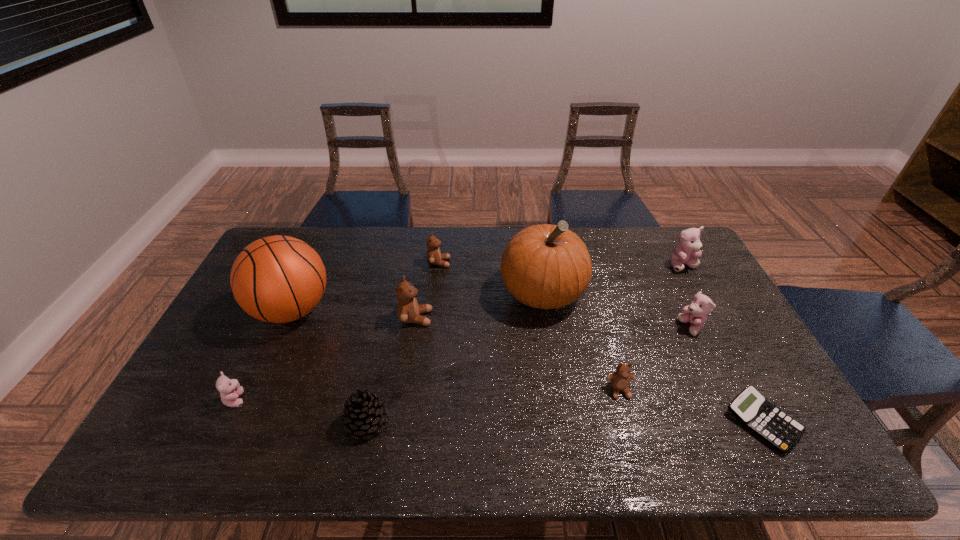
You are a GUI agent. You are given a task and a screenshot of the screen. Output one action in this format:
    pyautogui.click(x=<x>, y=<y>)
    Task: Click on the brown teddy bear that stands as the closest to the farthest pink teddy bear
    
    Given the screenshot: What is the action you would take?
    pyautogui.click(x=620, y=380)

This screenshot has width=960, height=540. I want to click on brown teddy bear object that ranks as the third closest to the pinecone, so click(x=620, y=380).

The width and height of the screenshot is (960, 540). What are the coordinates of `vacant position in the image that satisfies the following two spatial constraints: 1. at the face of the farthest pink teddy bear; 2. on the front-facing side of the second farthest brown teddy bear` in the screenshot? It's located at (711, 318).

The image size is (960, 540). Identify the location of free space that satisfies the following two spatial constraints: 1. on the stem of the orange pumpkin; 2. at the face of the leftmost pink teddy bear. (559, 399).

Find the location of a particular element. vacant space that satisfies the following two spatial constraints: 1. at the face of the farthest pink teddy bear; 2. at the face of the second biggest pink teddy bear is located at coordinates (717, 327).

Where is `vacant space that satisfies the following two spatial constraints: 1. on the front-facing side of the second biggest brown teddy bear; 2. on the front side of the basketball`? This screenshot has width=960, height=540. vacant space that satisfies the following two spatial constraints: 1. on the front-facing side of the second biggest brown teddy bear; 2. on the front side of the basketball is located at coordinates (434, 310).

Where is `free space that satisfies the following two spatial constraints: 1. on the front-facing side of the second biggest brown teddy bear; 2. on the right side of the shortest object`? Image resolution: width=960 pixels, height=540 pixels. free space that satisfies the following two spatial constraints: 1. on the front-facing side of the second biggest brown teddy bear; 2. on the right side of the shortest object is located at coordinates (421, 422).